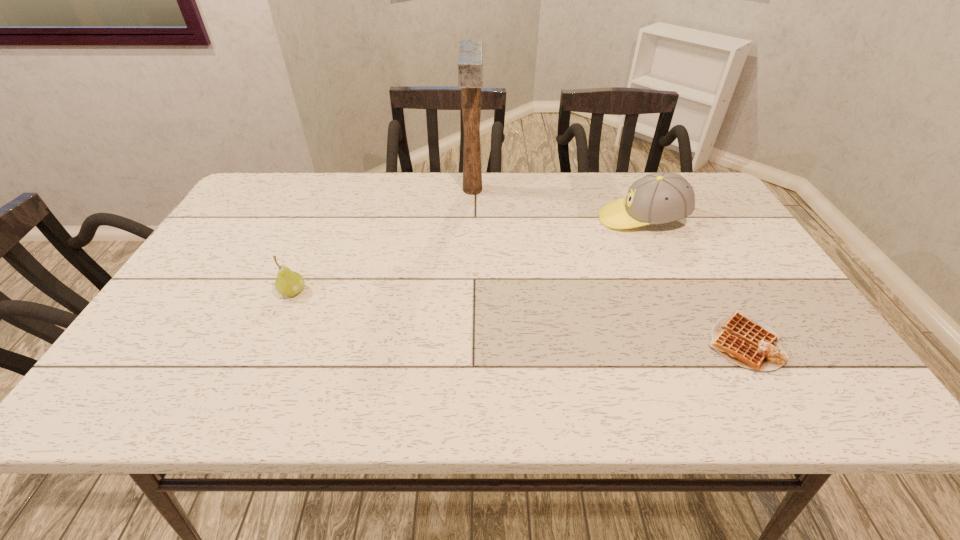
This screenshot has height=540, width=960. Identify the location of free point at the far edge. (461, 180).

This screenshot has height=540, width=960. Identify the location of vacant space at the near edge of the desktop. click(606, 379).

In the image, there is a desktop. In order to click on blank space at the left edge in this screenshot , I will do `click(272, 231)`.

Where is `free space at the right edge of the desktop`? free space at the right edge of the desktop is located at coordinates (752, 307).

You are a GUI agent. You are given a task and a screenshot of the screen. Output one action in this format:
    pyautogui.click(x=<x>, y=<y>)
    Task: Click on the blank space at the far left corner of the desktop
    This screenshot has width=960, height=540.
    Given the screenshot: What is the action you would take?
    coord(243,210)

At what (x,y) coordinates should I click in order to perform the action: click on unoccupied area between the nearest object and the baseball cap. Please return your answer as a coordinate pair (x, y). The image size is (960, 540). Looking at the image, I should click on (692, 281).

Find the location of a particular element. Image resolution: width=960 pixels, height=540 pixels. vacant space that's between the mallet and the waffle is located at coordinates (608, 267).

Locate an element on the screen. This screenshot has width=960, height=540. vacant area between the third shortest object and the second shortest object is located at coordinates (468, 255).

I want to click on free space between the waffle and the second tallest object, so click(x=692, y=281).

Identify the location of free spot between the baseball cap and the third farthest object. The width and height of the screenshot is (960, 540). pos(468,255).